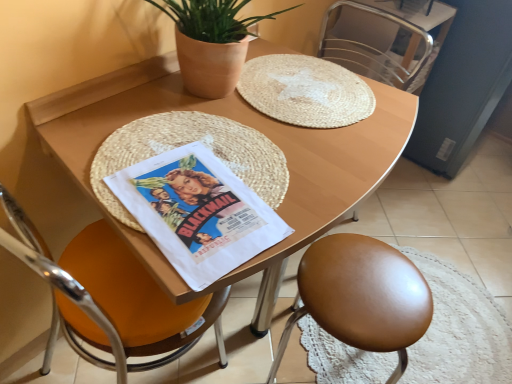
This screenshot has width=512, height=384. Find the location of `vacant space underneath terracotta pot at upper center (from a real-world perspective)`. vacant space underneath terracotta pot at upper center (from a real-world perspective) is located at coordinates (211, 93).